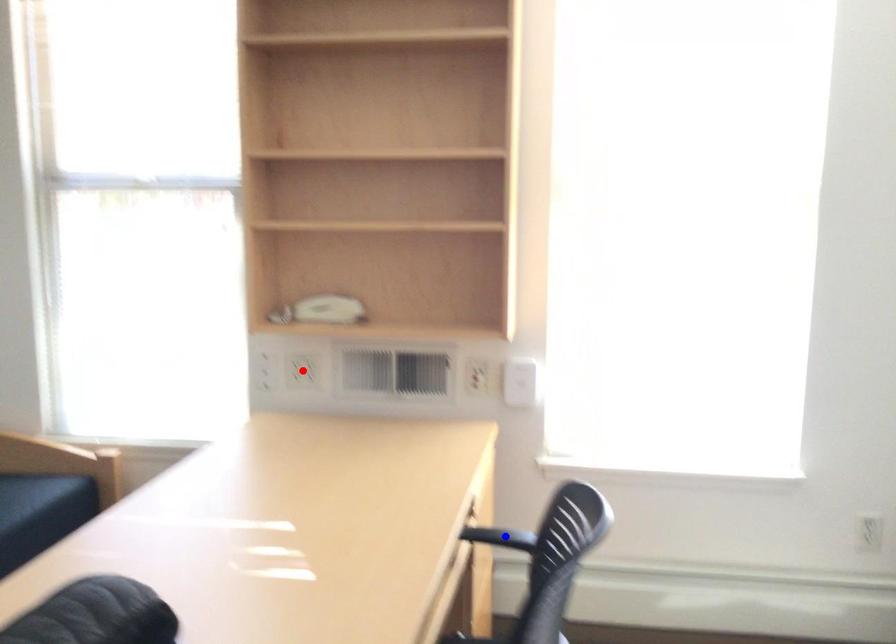
Question: Which of the two points in the image is closer to the camera?

Choices:
 (A) Blue point is closer.
 (B) Red point is closer.

Answer: (A)